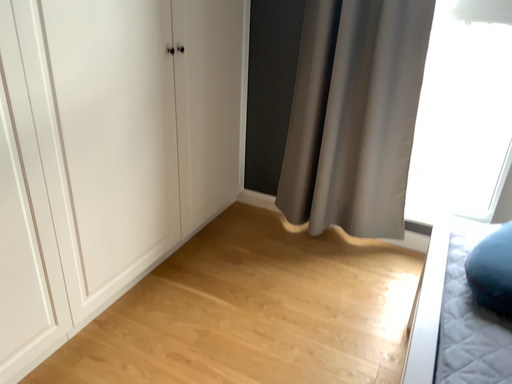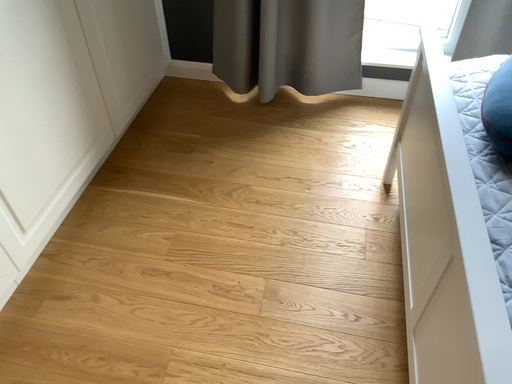
Question: How did the camera likely rotate when shooting the video?

Choices:
 (A) rotated right
 (B) rotated left

Answer: (A)